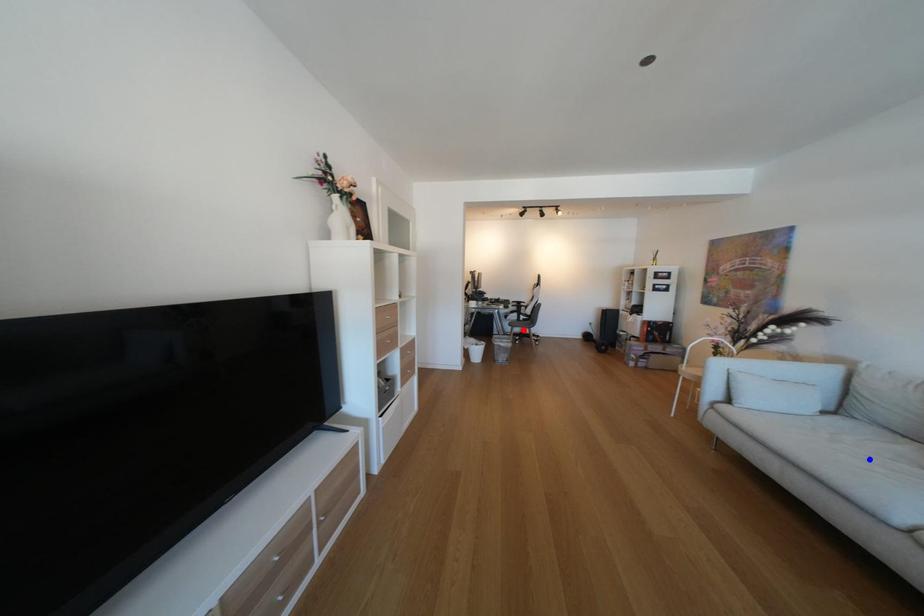
Question: In the image, two points are highlighted. Which point is nearer to the camera? Reply with the corresponding letter.

Choices:
 (A) blue point
 (B) red point

Answer: (A)